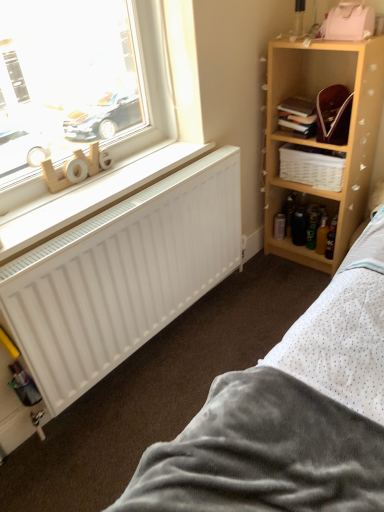
This screenshot has width=384, height=512. I want to click on vacant area to the right of white matte radiator at lower left, so click(x=230, y=314).